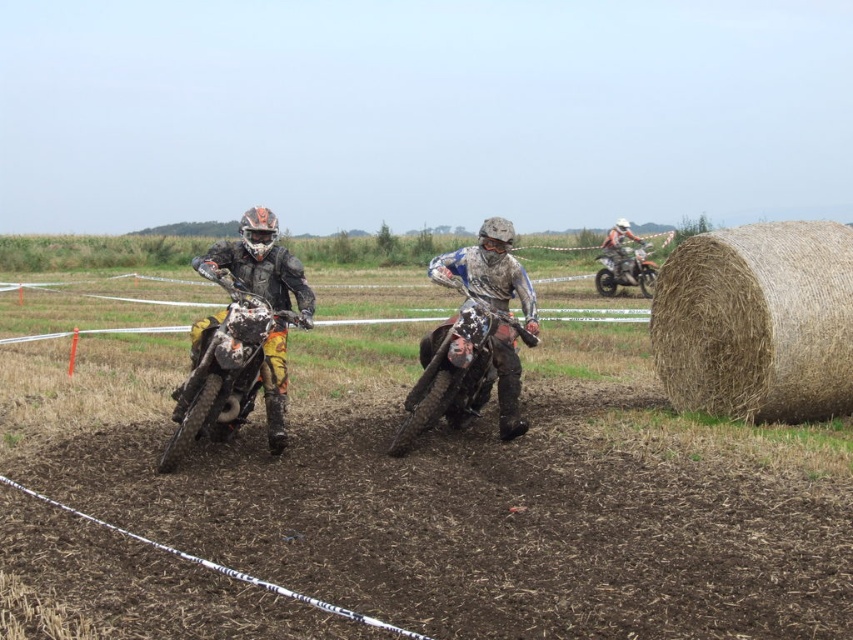
Is matte orange and white motorcycle at left taller than orange and white motocross gear at right?

No.

Is matte orange and white motorcycle at left smaller than orange and white motocross gear at right?

Yes, matte orange and white motorcycle at left is smaller than orange and white motocross gear at right.

Is point (292, 276) in front of point (624, 260)?

That is True.

Locate an element on the screen. The image size is (853, 640). matte orange and white motorcycle at left is located at coordinates [238, 356].

Is brown straw bale at right closer to camera compared to orange matte dirt bike at right?

Yes, brown straw bale at right is closer to the viewer.

Is point (659, 376) farther from camera compared to point (614, 275)?

That is False.

Where is `brown straw bale at right`? Image resolution: width=853 pixels, height=640 pixels. brown straw bale at right is located at coordinates (757, 321).

Find the location of a particular element. brown straw bale at right is located at coordinates (757, 321).

What do you see at coordinates (757, 321) in the screenshot? The image size is (853, 640). I see `brown straw bale at right` at bounding box center [757, 321].

Where is `brown straw bale at right`? brown straw bale at right is located at coordinates (757, 321).